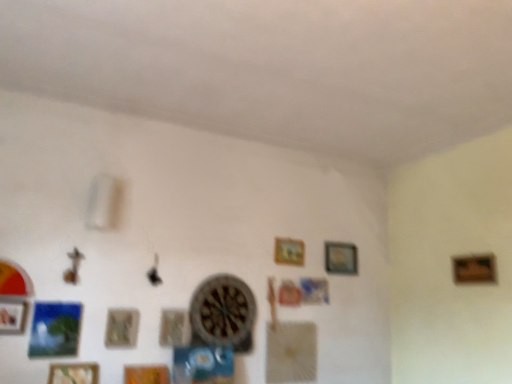
Question: Is wooden picture frame at lower left, the first picture frame from the left, located within wooden textured picture frame at lower left, the sixth picture frame from the right?

Choices:
 (A) no
 (B) yes

Answer: (A)

Question: Is wooden textured picture frame at lower left, the sixth picture frame from the right, further to the viewer compared to wooden picture frame at lower left, the eighth picture frame from the right?

Choices:
 (A) yes
 (B) no

Answer: (A)

Question: Is wooden textured picture frame at lower left, the sixth picture frame from the right, outside of wooden picture frame at lower left, the first picture frame from the left?

Choices:
 (A) yes
 (B) no

Answer: (A)

Question: Is wooden textured picture frame at lower left, which is the 3th picture frame in left-to-right order, facing towards wooden picture frame at lower left, the first picture frame from the left?

Choices:
 (A) yes
 (B) no

Answer: (B)

Question: Does wooden textured picture frame at lower left, the sixth picture frame from the right, have a lesser height compared to wooden picture frame at lower left, the eighth picture frame from the right?

Choices:
 (A) no
 (B) yes

Answer: (A)

Question: Considering the positions of point (201, 337) and point (15, 301), is point (201, 337) closer or farther from the camera than point (15, 301)?

Choices:
 (A) farther
 (B) closer

Answer: (A)

Question: From the image's perspective, is wooden clock at center located above or below wooden picture frame at lower left, the eighth picture frame from the right?

Choices:
 (A) below
 (B) above

Answer: (A)

Question: Visually, is wooden clock at center positioned to the left or to the right of wooden picture frame at lower left, the first picture frame from the left?

Choices:
 (A) right
 (B) left

Answer: (A)

Question: Is wooden clock at center spatially inside wooden picture frame at lower left, the eighth picture frame from the right, or outside of it?

Choices:
 (A) inside
 (B) outside

Answer: (B)

Question: Considering the positions of wooden frame at center, which appears as the 6th picture frame when viewed from the left, and wooden frame at right, the 1th picture frame in the right-to-left sequence, in the image, is wooden frame at center, which appears as the 6th picture frame when viewed from the left, taller or shorter than wooden frame at right, the 1th picture frame in the right-to-left sequence,?

Choices:
 (A) tall
 (B) short

Answer: (A)

Question: From a real-world perspective, relative to wooden frame at right, the 1th picture frame in the right-to-left sequence, is wooden frame at center, which appears as the 6th picture frame when viewed from the left, vertically above or below?

Choices:
 (A) above
 (B) below

Answer: (A)

Question: Looking at their shapes, would you say wooden frame at center, which appears as the 6th picture frame when viewed from the left, is wider or thinner than wooden frame at right, the 1th picture frame in the right-to-left sequence?

Choices:
 (A) wide
 (B) thin

Answer: (B)

Question: Considering their positions, is wooden frame at center, arranged as the third picture frame when viewed from the right, located in front of or behind wooden frame at right, the 8th picture frame when ordered from left to right?

Choices:
 (A) behind
 (B) front

Answer: (A)

Question: Considering the positions of wooden textured picture frame at lower left, the sixth picture frame from the right, and wooden picture frame at upper center, positioned as the 2th picture frame in right-to-left order, in the image, is wooden textured picture frame at lower left, the sixth picture frame from the right, bigger or smaller than wooden picture frame at upper center, positioned as the 2th picture frame in right-to-left order,?

Choices:
 (A) small
 (B) big

Answer: (A)

Question: Is point (117, 336) positioned closer to the camera than point (331, 258)?

Choices:
 (A) farther
 (B) closer

Answer: (B)